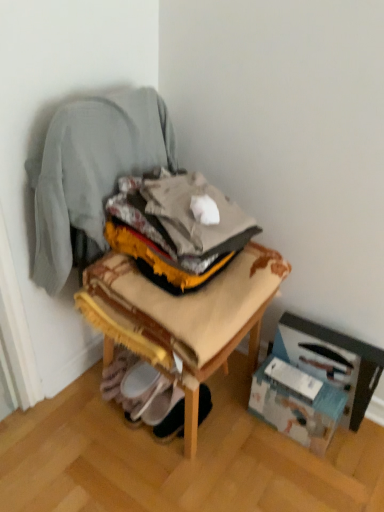
In order to click on vacant space that's between teal cardboard box at lower right, positioned as the 1th cardboard box in left-to-right order, and white fabric shoe at lower center in this screenshot , I will do `click(241, 428)`.